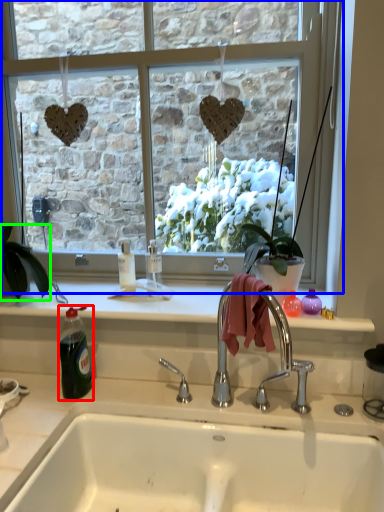
Question: Considering the real-world distances, which object is farthest from bottle (highlighted by a red box)? window (highlighted by a blue box) or houseplant (highlighted by a green box)?

Choices:
 (A) window
 (B) houseplant

Answer: (A)